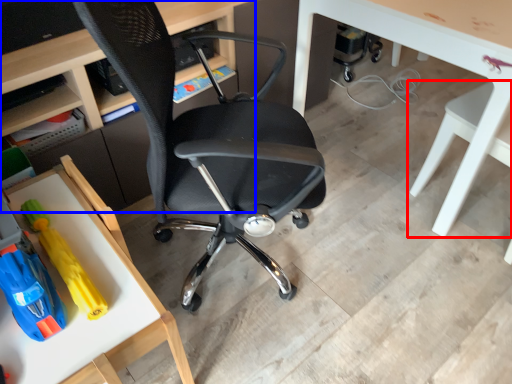
Question: Which object appears closest to the camera in this image, chair (highlighted by a red box) or desk (highlighted by a blue box)?

Choices:
 (A) chair
 (B) desk

Answer: (A)